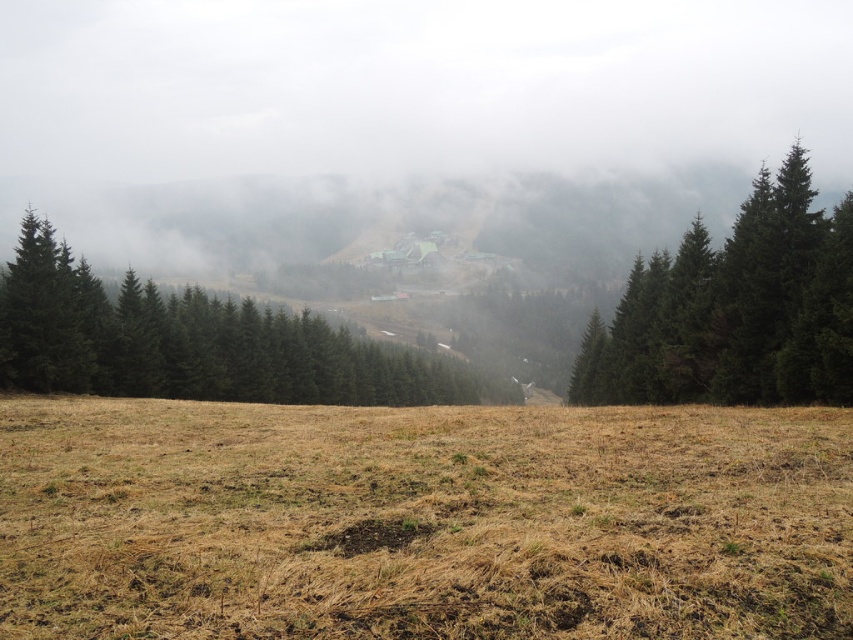
Question: Is brown grass at center closer to the viewer compared to green matte trees at center?

Choices:
 (A) no
 (B) yes

Answer: (B)

Question: Does brown grass at center have a lesser width compared to green matte trees at center?

Choices:
 (A) no
 (B) yes

Answer: (B)

Question: Which object is positioned farthest from the dark green textured tree at right?

Choices:
 (A) brown grass at center
 (B) green matte trees at center

Answer: (B)

Question: Based on their relative distances, which object is nearer to the dark green textured tree at right?

Choices:
 (A) green matte trees at center
 (B) brown grass at center

Answer: (B)

Question: Can you confirm if brown grass at center is bigger than dark green textured tree at right?

Choices:
 (A) yes
 (B) no

Answer: (B)

Question: Estimate the real-world distances between objects in this image. Which object is farther from the dark green textured tree at right?

Choices:
 (A) brown grass at center
 (B) green matte trees at center

Answer: (B)